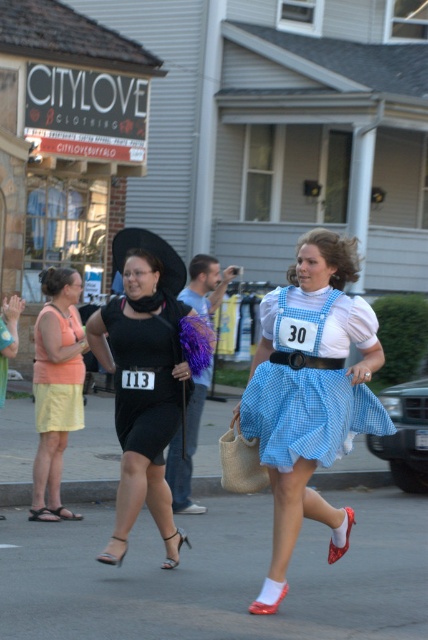
You are a photographer who needs to capture both the black matte dress at center and the blue gingham dress at center in a single shot. Based on their positions, which dress is positioned lower in the frame?

The black matte dress at center is positioned lower in the frame than the blue gingham dress at center because the black matte dress at center is below blue gingham dress at center.

You are a photographer trying to capture both the black matte dress at center and the blue gingham dress at center in a single shot. The camera you are using has a maximum focus range of 1 meter. Can you fit both dresses in the frame without moving the camera?

The black matte dress at center and blue gingham dress at center are 1.05 meters apart. Since the camera can only focus within 1 meter, the distance between them exceeds the focus range. Therefore, you cannot capture both dresses in the same frame without moving the camera.